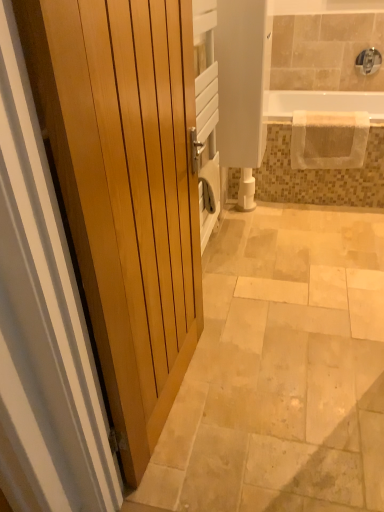
This screenshot has width=384, height=512. Describe the element at coordinates (368, 61) in the screenshot. I see `silver metallic faucet at upper right` at that location.

Find the location of a particular element. beige textured towel at upper right is located at coordinates (329, 139).

Locate an element on the screen. The width and height of the screenshot is (384, 512). silver metallic faucet at upper right is located at coordinates (368, 61).

How many degrees apart are the facing directions of white glossy toilet paper at center and light wood door at left?

white glossy toilet paper at center and light wood door at left are facing 4.35 degrees away from each other.

Based on the photo, from the image's perspective, who appears lower, white glossy toilet paper at center or light wood door at left?

From the image's view, light wood door at left is below.

Which of these two, white glossy toilet paper at center or light wood door at left, is smaller?

white glossy toilet paper at center is smaller.

Is white glossy toilet paper at center not within light wood door at left?

Yes.

Is white glossy toilet paper at center to the left or to the right of beige textured towel at upper right in the image?

Based on their positions, white glossy toilet paper at center is located to the left of beige textured towel at upper right.

Is point (253, 206) closer to viewer compared to point (328, 120)?

No, (253, 206) is behind (328, 120).

From a real-world perspective, is white glossy toilet paper at center below beige textured towel at upper right?

Yes.

Locate an element on the screen. Image resolution: width=384 pixels, height=512 pixels. toilet paper below the beige textured towel at upper right (from a real-world perspective) is located at coordinates (246, 191).

Can you see light wood door at left touching white textured bathtub at upper right?

No, light wood door at left is not touching white textured bathtub at upper right.

From a real-world perspective, is light wood door at left physically below white textured bathtub at upper right?

Incorrect, from a real-world perspective, light wood door at left is higher than white textured bathtub at upper right.

Considering the relative sizes of light wood door at left and white textured bathtub at upper right in the image provided, is light wood door at left thinner than white textured bathtub at upper right?

Yes, light wood door at left is thinner than white textured bathtub at upper right.

Which is more to the left, beige textured towel at upper right or light wood door at left?

light wood door at left is more to the left.

Can we say beige textured towel at upper right lies outside light wood door at left?

beige textured towel at upper right is positioned outside light wood door at left.

Considering the relative sizes of beige textured towel at upper right and light wood door at left in the image provided, is beige textured towel at upper right taller than light wood door at left?

Incorrect, the height of beige textured towel at upper right is not larger of that of light wood door at left.

How distant is beige textured towel at upper right from light wood door at left?

beige textured towel at upper right is 6.19 feet from light wood door at left.

Between silver metallic faucet at upper right and light wood door at left, which one has more height?

Standing taller between the two is light wood door at left.

Which of these two, silver metallic faucet at upper right or light wood door at left, is wider?

light wood door at left is wider.

Does silver metallic faucet at upper right have a smaller size compared to light wood door at left?

Correct, silver metallic faucet at upper right occupies less space than light wood door at left.

The height and width of the screenshot is (512, 384). What are the coordinates of `faucet on the right of light wood door at left` in the screenshot? It's located at (368, 61).

Considering the sizes of objects silver metallic faucet at upper right and white textured bathtub at upper right in the image provided, who is bigger, silver metallic faucet at upper right or white textured bathtub at upper right?

white textured bathtub at upper right.

The height and width of the screenshot is (512, 384). What are the coordinates of `faucet above the white textured bathtub at upper right (from a real-world perspective)` in the screenshot? It's located at (368, 61).

Is point (367, 55) farther from camera compared to point (354, 97)?

No.

Can you tell me how much white textured bathtub at upper right and light wood door at left differ in facing direction?

87.3 degrees.

From a real-world perspective, is white textured bathtub at upper right on light wood door at left?

No.

Is white textured bathtub at upper right completely or partially outside of light wood door at left?

Absolutely, white textured bathtub at upper right is external to light wood door at left.

From the image's perspective, which object appears higher, white textured bathtub at upper right or light wood door at left?

From the image's view, white textured bathtub at upper right is above.

Where is `door below the white glossy toilet paper at center (from the image's perspective)`? Image resolution: width=384 pixels, height=512 pixels. door below the white glossy toilet paper at center (from the image's perspective) is located at coordinates (125, 190).

Locate an element on the screen. blanket on the right of white glossy toilet paper at center is located at coordinates (329, 139).

Which object lies further to the anchor point beige textured towel at upper right, light wood door at left or white glossy toilet paper at center?

light wood door at left is positioned further to the anchor beige textured towel at upper right.

From the image, which object appears to be farther from white glossy toilet paper at center, white textured bathtub at upper right or beige textured towel at upper right?

The object further to white glossy toilet paper at center is white textured bathtub at upper right.

Which object lies further to the anchor point silver metallic faucet at upper right, white glossy toilet paper at center or beige textured towel at upper right?

white glossy toilet paper at center is positioned further to the anchor silver metallic faucet at upper right.

Which object lies further to the anchor point beige textured towel at upper right, white glossy toilet paper at center or silver metallic faucet at upper right?

Based on the image, silver metallic faucet at upper right appears to be further to beige textured towel at upper right.

When comparing their distances from beige textured towel at upper right, does silver metallic faucet at upper right or white glossy toilet paper at center seem closer?

white glossy toilet paper at center.

Which object lies nearer to the anchor point silver metallic faucet at upper right, light wood door at left or white textured bathtub at upper right?

white textured bathtub at upper right lies closer to silver metallic faucet at upper right than the other object.

Which object lies nearer to the anchor point beige textured towel at upper right, light wood door at left or silver metallic faucet at upper right?

Based on the image, silver metallic faucet at upper right appears to be nearer to beige textured towel at upper right.

Based on their spatial positions, is white textured bathtub at upper right or beige textured towel at upper right further from silver metallic faucet at upper right?

beige textured towel at upper right.

At what (x,y) coordinates should I click in order to perform the action: click on bathtub between silver metallic faucet at upper right and white glossy toilet paper at center vertically. Please return your answer as a coordinate pair (x, y). Looking at the image, I should click on (320, 103).

Image resolution: width=384 pixels, height=512 pixels. I want to click on toilet paper between light wood door at left and silver metallic faucet at upper right in the front-back direction, so click(x=246, y=191).

Locate an element on the screen. Image resolution: width=384 pixels, height=512 pixels. bathtub between silver metallic faucet at upper right and beige textured towel at upper right vertically is located at coordinates (320, 103).

You are a GUI agent. You are given a task and a screenshot of the screen. Output one action in this format:
    pyautogui.click(x=<x>, y=<y>)
    Task: Click on the bathtub located between light wood door at left and silver metallic faucet at upper right in the depth direction
    The width and height of the screenshot is (384, 512).
    Given the screenshot: What is the action you would take?
    pyautogui.click(x=320, y=103)